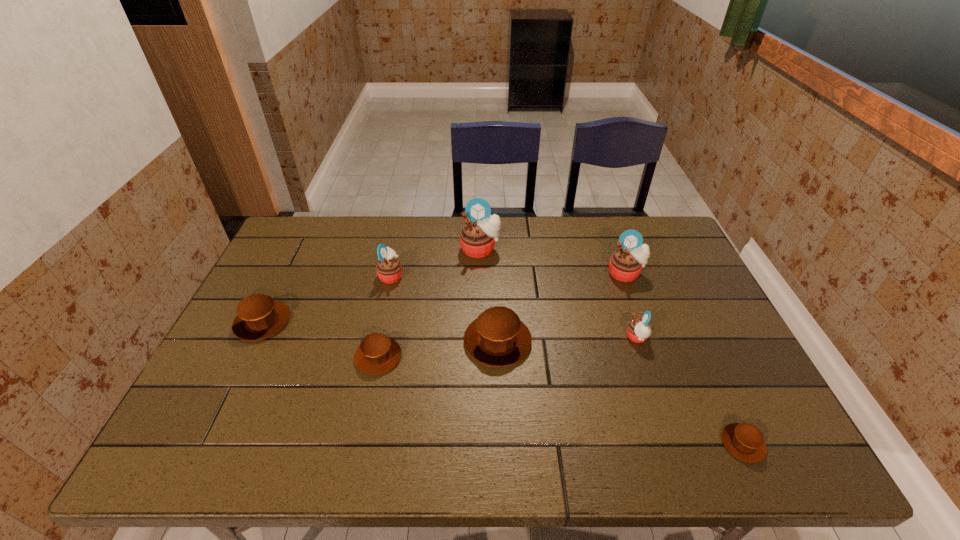
At what (x,y) coordinates should I click in order to perform the action: click on brown muffin that stands as the second closest to the third biggest brown muffin. Please return your answer as a coordinate pair (x, y). Image resolution: width=960 pixels, height=540 pixels. Looking at the image, I should click on (259, 316).

The image size is (960, 540). Identify the location of free space that satisfies the following two spatial constraints: 1. on the front-facing side of the third biggest pink muffin; 2. on the left side of the nearest muffin. (353, 443).

This screenshot has width=960, height=540. What are the coordinates of `free point that satisfies the following two spatial constraints: 1. on the front-facing side of the smallest pink muffin; 2. on the back side of the shortest object` in the screenshot? It's located at (673, 443).